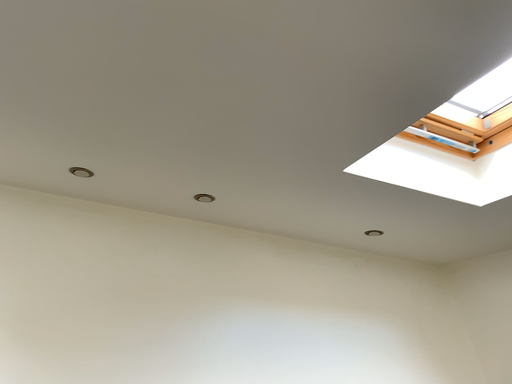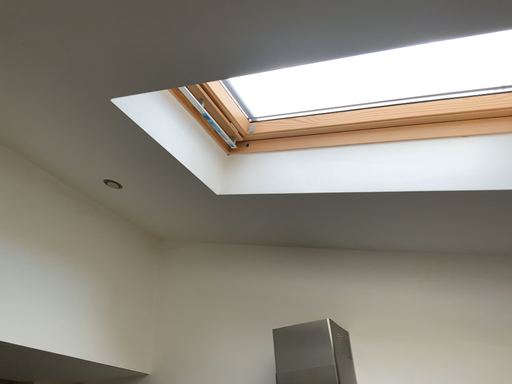
Question: How did the camera likely rotate when shooting the video?

Choices:
 (A) rotated right
 (B) rotated left

Answer: (A)